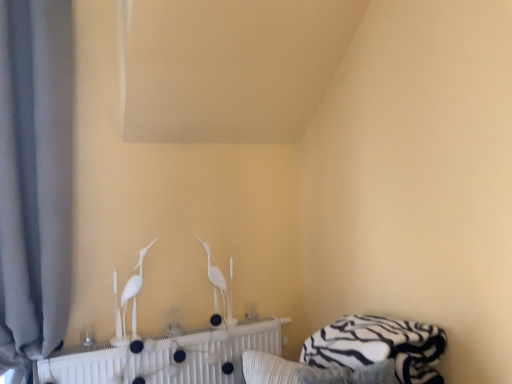
Question: From the image's perspective, is white matte radiator at center located beneath white glossy bird at center, the 2th bird viewed from the right?

Choices:
 (A) yes
 (B) no

Answer: (A)

Question: Is white matte radiator at center beside white glossy bird at center, which ranks as the second bird in back-to-front order?

Choices:
 (A) no
 (B) yes

Answer: (A)

Question: From a real-world perspective, is white matte radiator at center on white glossy bird at center, which ranks as the second bird in back-to-front order?

Choices:
 (A) yes
 (B) no

Answer: (B)

Question: Considering the relative sizes of white matte radiator at center and white glossy bird at center, which ranks as the second bird in back-to-front order, in the image provided, is white matte radiator at center thinner than white glossy bird at center, which ranks as the second bird in back-to-front order,?

Choices:
 (A) no
 (B) yes

Answer: (A)

Question: Considering the relative sizes of white matte radiator at center and white glossy bird at center, the first bird viewed from the front, in the image provided, is white matte radiator at center smaller than white glossy bird at center, the first bird viewed from the front,?

Choices:
 (A) no
 (B) yes

Answer: (A)

Question: In the image, is gray fabric curtain at left positioned in front of or behind white zebra-patterned bed at lower right?

Choices:
 (A) behind
 (B) front

Answer: (A)

Question: From the image's perspective, is gray fabric curtain at left positioned above or below white zebra-patterned bed at lower right?

Choices:
 (A) below
 (B) above

Answer: (B)

Question: From their relative heights in the image, would you say gray fabric curtain at left is taller or shorter than white zebra-patterned bed at lower right?

Choices:
 (A) tall
 (B) short

Answer: (A)

Question: Would you say gray fabric curtain at left is inside or outside white zebra-patterned bed at lower right?

Choices:
 (A) inside
 (B) outside

Answer: (B)

Question: Considering the positions of white glossy bird at center, the first bird when ordered from left to right, and white matte radiator at center in the image, is white glossy bird at center, the first bird when ordered from left to right, bigger or smaller than white matte radiator at center?

Choices:
 (A) small
 (B) big

Answer: (A)

Question: In the image, is white glossy bird at center, which ranks as the second bird in back-to-front order, positioned in front of or behind white matte radiator at center?

Choices:
 (A) behind
 (B) front

Answer: (A)

Question: Considering the positions of point (134, 278) and point (223, 337), is point (134, 278) closer or farther from the camera than point (223, 337)?

Choices:
 (A) farther
 (B) closer

Answer: (B)

Question: Considering the relative positions of white glossy bird at center, the 2th bird viewed from the right, and white matte radiator at center in the image provided, is white glossy bird at center, the 2th bird viewed from the right, to the left or to the right of white matte radiator at center?

Choices:
 (A) left
 (B) right

Answer: (A)

Question: In the image, is white matte radiator at center positioned in front of or behind gray fabric curtain at left?

Choices:
 (A) front
 (B) behind

Answer: (B)

Question: From a real-world perspective, relative to gray fabric curtain at left, is white matte radiator at center vertically above or below?

Choices:
 (A) below
 (B) above

Answer: (A)